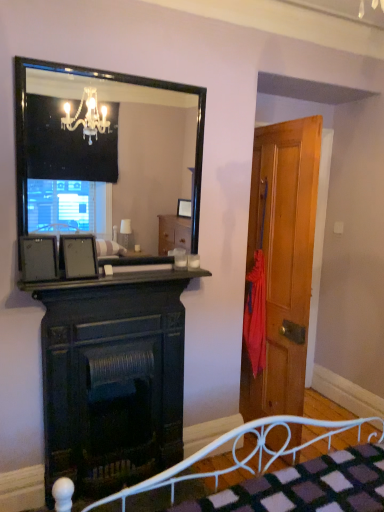
The width and height of the screenshot is (384, 512). I want to click on free space above dark wood fireplace at center (from a real-world perspective), so click(131, 279).